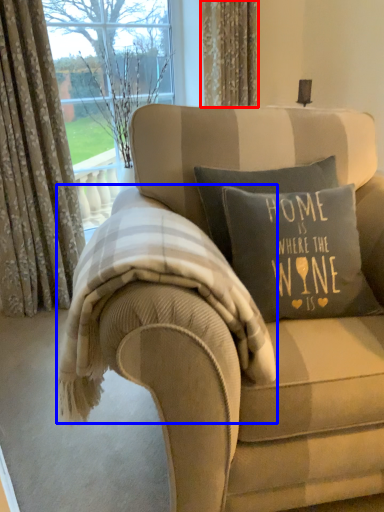
Question: Which object appears closest to the camera in this image, curtain (highlighted by a red box) or bedding (highlighted by a blue box)?

Choices:
 (A) curtain
 (B) bedding

Answer: (B)